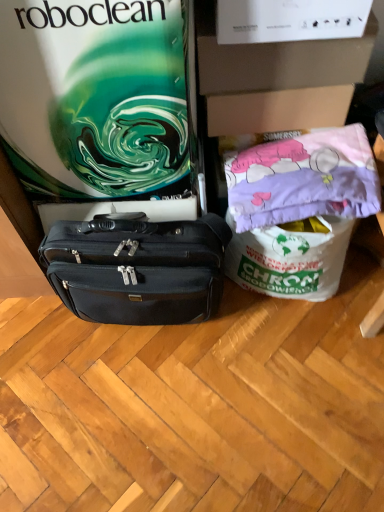
Question: Does pink fabric pillow at upper right come in front of black leather briefcase at center?

Choices:
 (A) yes
 (B) no

Answer: (B)

Question: Does pink fabric pillow at upper right have a greater width compared to black leather briefcase at center?

Choices:
 (A) no
 (B) yes

Answer: (B)

Question: Does pink fabric pillow at upper right have a lesser width compared to black leather briefcase at center?

Choices:
 (A) yes
 (B) no

Answer: (B)

Question: Is pink fabric pillow at upper right taller than black leather briefcase at center?

Choices:
 (A) yes
 (B) no

Answer: (B)

Question: Does pink fabric pillow at upper right have a larger size compared to black leather briefcase at center?

Choices:
 (A) yes
 (B) no

Answer: (B)

Question: Is black leather briefcase at center bigger or smaller than matte green swirl at upper left?

Choices:
 (A) big
 (B) small

Answer: (B)

Question: From the image's perspective, is black leather briefcase at center positioned above or below matte green swirl at upper left?

Choices:
 (A) above
 (B) below

Answer: (B)

Question: From a real-world perspective, relative to matte green swirl at upper left, is black leather briefcase at center vertically above or below?

Choices:
 (A) above
 (B) below

Answer: (B)

Question: Is black leather briefcase at center wider or thinner than matte green swirl at upper left?

Choices:
 (A) thin
 (B) wide

Answer: (A)

Question: In the image, is matte green swirl at upper left positioned in front of or behind pink fabric pillow at upper right?

Choices:
 (A) behind
 (B) front

Answer: (B)

Question: From the image's perspective, is matte green swirl at upper left above or below pink fabric pillow at upper right?

Choices:
 (A) above
 (B) below

Answer: (A)

Question: Considering the positions of matte green swirl at upper left and pink fabric pillow at upper right in the image, is matte green swirl at upper left wider or thinner than pink fabric pillow at upper right?

Choices:
 (A) thin
 (B) wide

Answer: (B)

Question: Choose the correct answer: Is matte green swirl at upper left inside pink fabric pillow at upper right or outside it?

Choices:
 (A) inside
 (B) outside

Answer: (B)

Question: Based on their sizes in the image, would you say matte green swirl at upper left is bigger or smaller than white cardboard box at upper center?

Choices:
 (A) small
 (B) big

Answer: (B)

Question: From the image's perspective, is matte green swirl at upper left located above or below white cardboard box at upper center?

Choices:
 (A) above
 (B) below

Answer: (B)